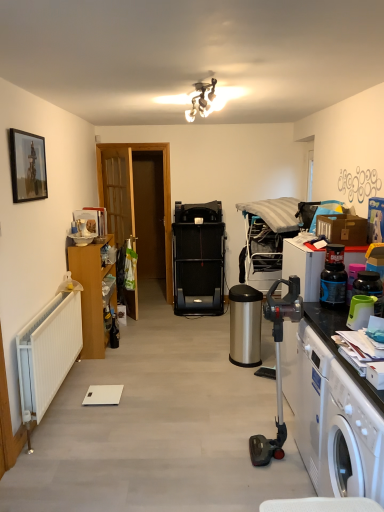
Question: From their relative heights in the image, would you say white plastic washing machine at lower right is taller or shorter than matte black picture frame at upper left?

Choices:
 (A) short
 (B) tall

Answer: (B)

Question: Visually, is white plastic washing machine at lower right positioned to the left or to the right of matte black picture frame at upper left?

Choices:
 (A) right
 (B) left

Answer: (A)

Question: Based on their relative distances, which object is farther from the metallic gray vacuum cleaner at right?

Choices:
 (A) wooden door at left
 (B) wooden cabinet at left
 (C) matte black picture frame at upper left
 (D) blue plastic bottle at right
 (E) metallic chrome light fixture at upper center

Answer: (A)

Question: Which of these objects is positioned farthest from the blue plastic bottle at right?

Choices:
 (A) metallic gray vacuum cleaner at right
 (B) metallic chrome light fixture at upper center
 (C) matte black picture frame at upper left
 (D) white plastic washing machine at lower right
 (E) wooden door at left

Answer: (E)